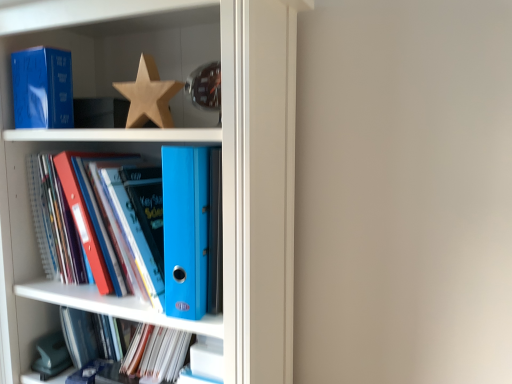
Question: Is wooden star at upper center wider or thinner than matte blue folder at lower center, the first book ordered from the bottom?

Choices:
 (A) wide
 (B) thin

Answer: (B)

Question: From a real-world perspective, is wooden star at upper center above or below matte blue folder at lower center, the first book ordered from the bottom?

Choices:
 (A) above
 (B) below

Answer: (A)

Question: Which object is the farthest from the blue plastic ring binder at center, the second book in the bottom-to-top sequence?

Choices:
 (A) matte blue binder at center
 (B) wooden star at upper center
 (C) matte blue folder at lower center, the first book ordered from the bottom
 (D) matte blue paperback book at upper left

Answer: (B)

Question: Estimate the real-world distances between objects in this image. Which object is closer to the blue plastic ring binder at center, placed as the first book when sorted from top to bottom?

Choices:
 (A) matte blue paperback book at upper left
 (B) wooden star at upper center
 (C) matte blue binder at center
 (D) matte blue folder at lower center, placed as the second book when sorted from top to bottom

Answer: (C)